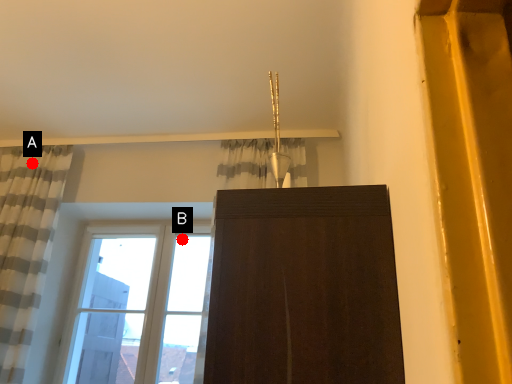
Question: Two points are circled on the image, labeled by A and B beside each circle. Among these points, which one is nearest to the camera?

Choices:
 (A) A is closer
 (B) B is closer

Answer: (A)